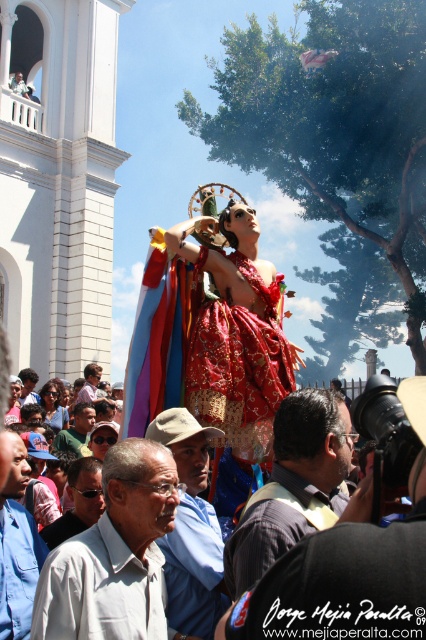
Question: Which object is closer to the camera taking this photo?

Choices:
 (A) sunglassesmaterial at lower left
 (B) green shirt at center
 (C) matte brown shirt at center

Answer: (C)

Question: Which object appears farthest from the camera in this image?

Choices:
 (A) blue denim shirt at lower left
 (B) red brocade dress at center

Answer: (B)

Question: Does matte brown shirt at center lie behind green shirt at center?

Choices:
 (A) no
 (B) yes

Answer: (A)

Question: Where is red brocade dress at center located in relation to green shirt at center in the image?

Choices:
 (A) below
 (B) above

Answer: (B)

Question: Which object appears closest to the camera in this image?

Choices:
 (A) green shirt at center
 (B) matte brown shirt at center
 (C) red brocade dress at center
 (D) blue denim shirt at lower left

Answer: (B)

Question: Is red brocade dress at center wider than blue denim shirt at lower left?

Choices:
 (A) no
 (B) yes

Answer: (B)